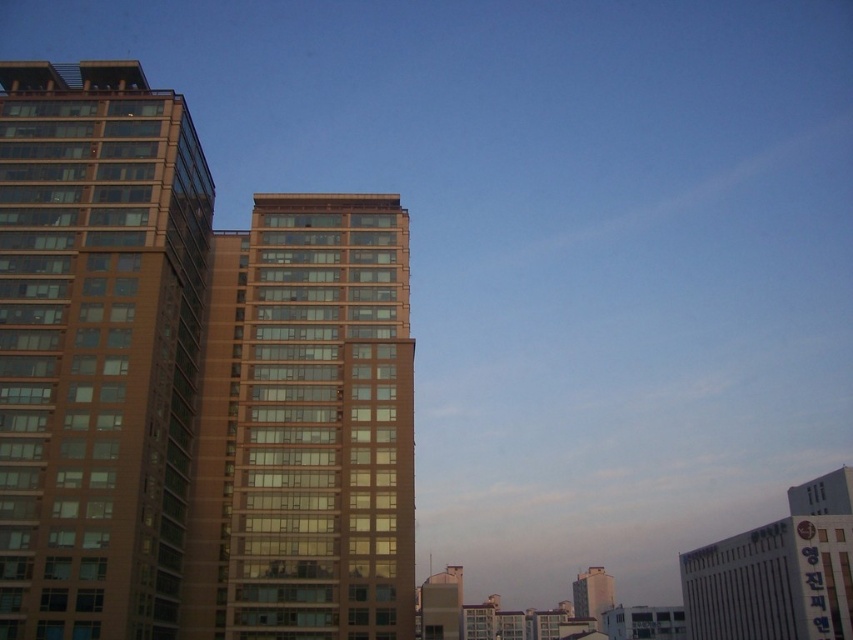
Is brown glass building at center wider than matte brown building at center?

Incorrect, brown glass building at center's width does not surpass matte brown building at center's.

Which is more to the right, brown glass building at center or matte brown building at center?

matte brown building at center

Locate an element on the screen. The width and height of the screenshot is (853, 640). brown glass building at center is located at coordinates click(x=305, y=428).

Who is taller, brown glass building at left or brown glass building at center?

brown glass building at left is taller.

Identify the location of brown glass building at left. (96, 348).

Locate an element on the screen. The image size is (853, 640). brown glass building at left is located at coordinates [x=96, y=348].

Which is above, brown glass building at left or matte brown building at center?

brown glass building at left is higher up.

Which is behind, point (6, 548) or point (589, 588)?

The point (589, 588) is more distant.

The image size is (853, 640). Identify the location of brown glass building at left. (96, 348).